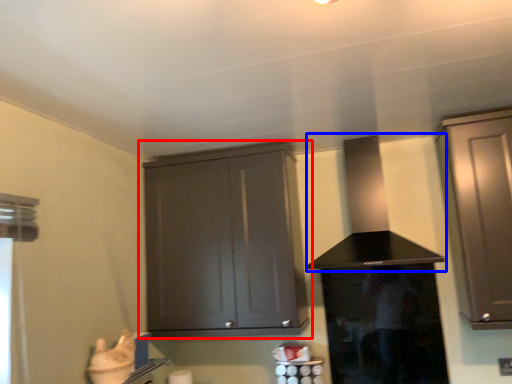
Question: Which point is further to the camera, cabinetry (highlighted by a red box) or vent (highlighted by a blue box)?

Choices:
 (A) cabinetry
 (B) vent

Answer: (A)